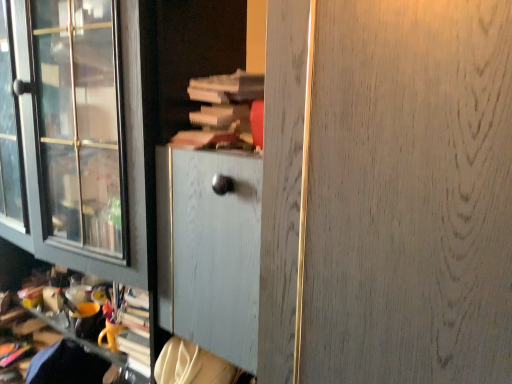
Question: From the image's perspective, relative to white wood screen door at center, is wooden book at center above or below?

Choices:
 (A) below
 (B) above

Answer: (B)

Question: Is wooden book at center taller or shorter than white wood screen door at center?

Choices:
 (A) tall
 (B) short

Answer: (B)

Question: Looking at their shapes, would you say wooden book at center is wider or thinner than white wood screen door at center?

Choices:
 (A) thin
 (B) wide

Answer: (A)

Question: Considering the positions of white wood screen door at center and wooden book at center in the image, is white wood screen door at center bigger or smaller than wooden book at center?

Choices:
 (A) small
 (B) big

Answer: (B)

Question: From the image's perspective, relative to wooden book at center, is white wood screen door at center above or below?

Choices:
 (A) below
 (B) above

Answer: (A)

Question: Considering the positions of white wood screen door at center and wooden book at center in the image, is white wood screen door at center wider or thinner than wooden book at center?

Choices:
 (A) wide
 (B) thin

Answer: (A)

Question: In terms of height, does white wood screen door at center look taller or shorter compared to wooden book at center?

Choices:
 (A) tall
 (B) short

Answer: (A)